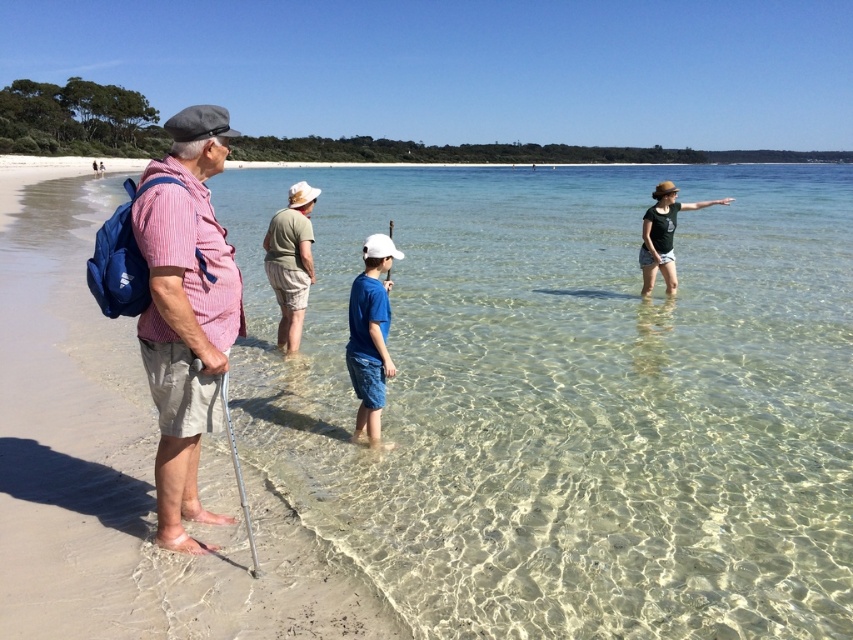
Question: Considering the real-world distances, which object is farthest from the smooth sand beach at left?

Choices:
 (A) striped cotton shirt at left
 (B) clear glassy water at center

Answer: (B)

Question: Estimate the real-world distances between objects in this image. Which object is farther from the striped cotton shirt at left?

Choices:
 (A) clear glassy water at center
 (B) smooth sand beach at left
 (C) blue cotton shirt at center

Answer: (A)

Question: Is striped cotton shirt at left in front of blue cotton shirt at center?

Choices:
 (A) no
 (B) yes

Answer: (B)

Question: Observing the image, what is the correct spatial positioning of striped cotton shirt at left in reference to blue cotton shirt at center?

Choices:
 (A) right
 (B) left

Answer: (B)

Question: Which point appears farthest from the camera in this image?

Choices:
 (A) (51, 577)
 (B) (350, 289)

Answer: (B)

Question: Considering the relative positions of striped cotton shirt at left and blue cotton shirt at center in the image provided, where is striped cotton shirt at left located with respect to blue cotton shirt at center?

Choices:
 (A) left
 (B) right

Answer: (A)